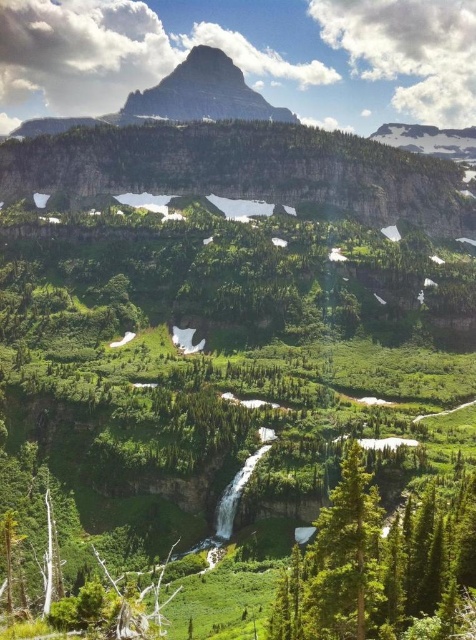
Question: Does green matte tree at lower center have a smaller size compared to rugged granite mountain at upper center?

Choices:
 (A) yes
 (B) no

Answer: (A)

Question: Which point is farther to the camera?

Choices:
 (A) (208, 60)
 (B) (345, 580)

Answer: (A)

Question: Is green matte tree at lower center to the right of rugged granite mountain at upper center from the viewer's perspective?

Choices:
 (A) no
 (B) yes

Answer: (B)

Question: Which point appears farthest from the camera in this image?

Choices:
 (A) (208, 83)
 (B) (267, 628)

Answer: (A)

Question: In this image, where is green matte tree at lower center located relative to rugged granite mountain at upper center?

Choices:
 (A) right
 (B) left

Answer: (A)

Question: Among these points, which one is farthest from the camera?

Choices:
 (A) (430, 483)
 (B) (122, 116)

Answer: (B)